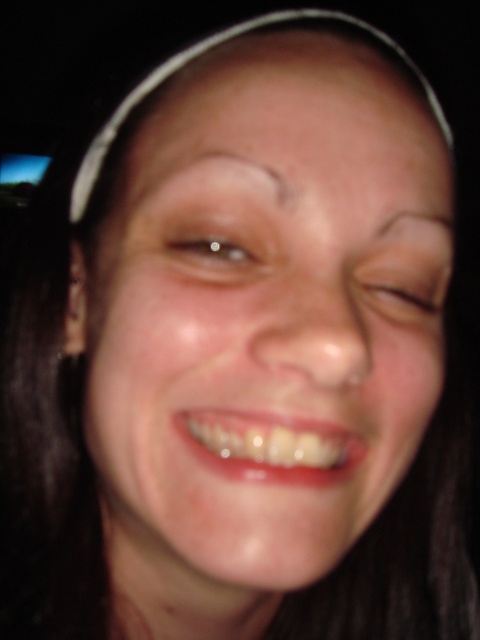
Does smooth skin face at center have a larger size compared to smooth skin nose at center?

Yes, smooth skin face at center is bigger than smooth skin nose at center.

The image size is (480, 640). I want to click on smooth skin face at center, so click(x=259, y=330).

Where is `smooth skin face at center`? smooth skin face at center is located at coordinates (259, 330).

I want to click on smooth skin face at center, so click(259, 330).

Does smooth skin nose at center appear on the right side of brown matte eye at center?

Incorrect, smooth skin nose at center is not on the right side of brown matte eye at center.

Between smooth skin nose at center and brown matte eye at center, which one is positioned higher?

brown matte eye at center is higher up.

What do you see at coordinates (315, 333) in the screenshot?
I see `smooth skin nose at center` at bounding box center [315, 333].

Find the location of a particular element. smooth skin nose at center is located at coordinates (315, 333).

Is point (298, 333) positioned before point (239, 240)?

Yes, point (298, 333) is in front of point (239, 240).

Is smooth skin face at center further to the viewer compared to clear crystal eye at center?

No, smooth skin face at center is in front of clear crystal eye at center.

Which is in front, point (126, 356) or point (210, 230)?

Point (210, 230) is more forward.

Locate an element on the screen. smooth skin face at center is located at coordinates (259, 330).